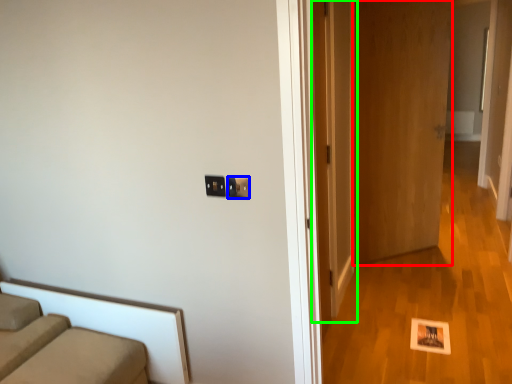
Question: Which object is the farthest from door (highlighted by a red box)? Choose among these: electric outlet (highlighted by a blue box) or door (highlighted by a green box).

Choices:
 (A) electric outlet
 (B) door

Answer: (A)